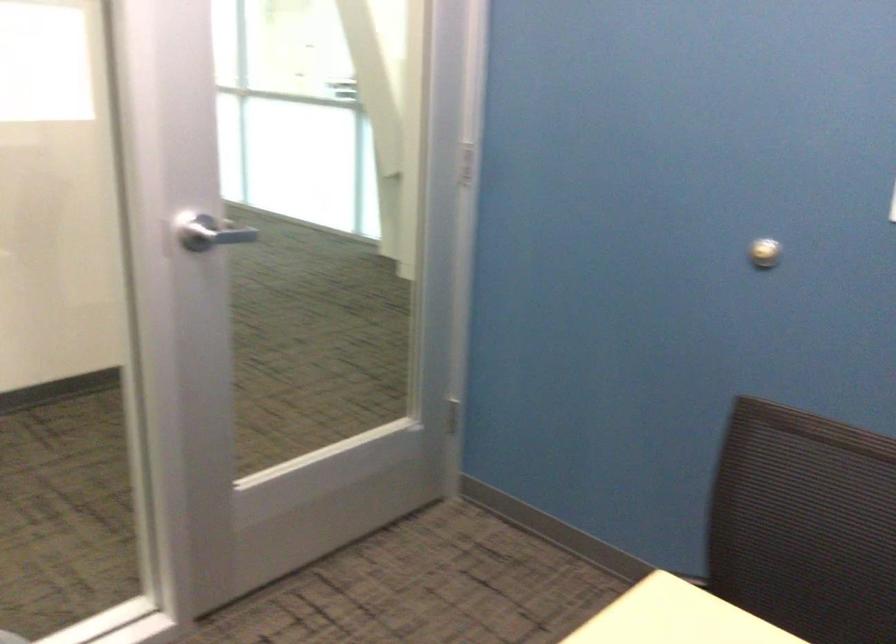
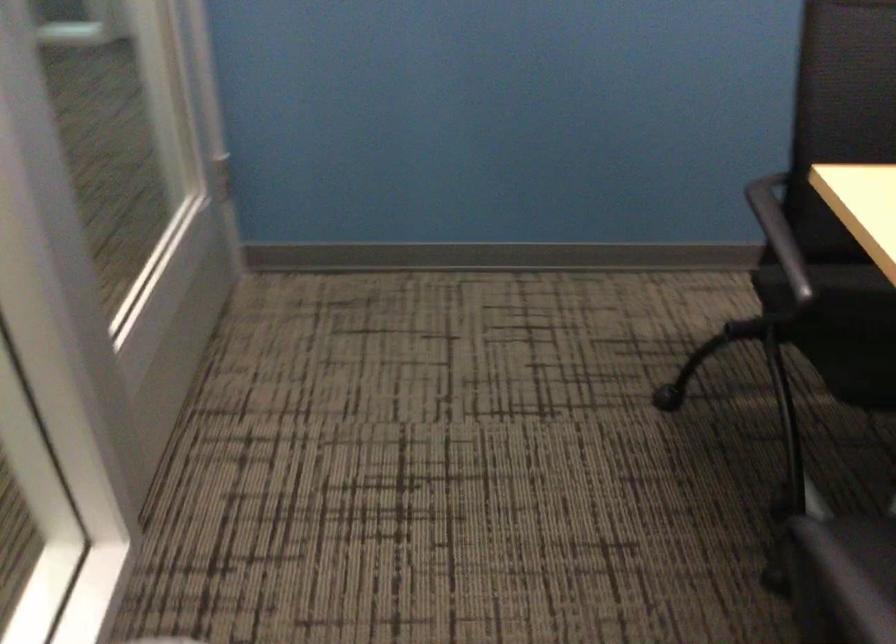
The first image is from the beginning of the video and the second image is from the end. How did the camera likely rotate when shooting the video?

The rotation direction of the camera is right-down.